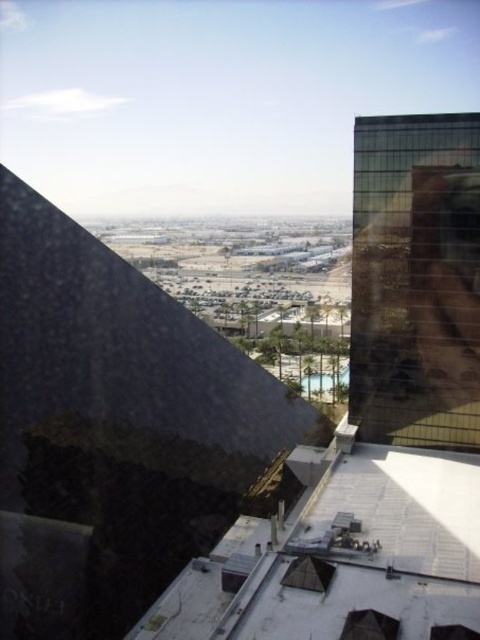
Between point (9, 490) and point (389, 636), which one is positioned behind?

Point (9, 490)

Consider the image. Measure the distance between dark granite pyramid at center and camera.

dark granite pyramid at center and camera are 33.96 meters apart from each other.

Between point (119, 356) and point (383, 618), which one is positioned behind?

The point (119, 356) is behind.

Locate an element on the screen. Image resolution: width=480 pixels, height=640 pixels. dark granite pyramid at center is located at coordinates (115, 429).

Does dark granite pyramid at center have a greater width compared to matte glass pyramid at center?

Correct, the width of dark granite pyramid at center exceeds that of matte glass pyramid at center.

How much distance is there between dark granite pyramid at center and matte glass pyramid at center?

dark granite pyramid at center is 18.66 meters away from matte glass pyramid at center.

Describe the element at coordinates (115, 429) in the screenshot. I see `dark granite pyramid at center` at that location.

Where is `dark granite pyramid at center`? The height and width of the screenshot is (640, 480). dark granite pyramid at center is located at coordinates (115, 429).

Is dark granite pyramid at center to the right of green reflective glass building at right from the viewer's perspective?

In fact, dark granite pyramid at center is to the left of green reflective glass building at right.

Does dark granite pyramid at center have a smaller size compared to green reflective glass building at right?

No, dark granite pyramid at center is not smaller than green reflective glass building at right.

Is point (126, 364) more distant than point (395, 396)?

No, it is in front of (395, 396).

The width and height of the screenshot is (480, 640). What are the coordinates of `dark granite pyramid at center` in the screenshot? It's located at (115, 429).